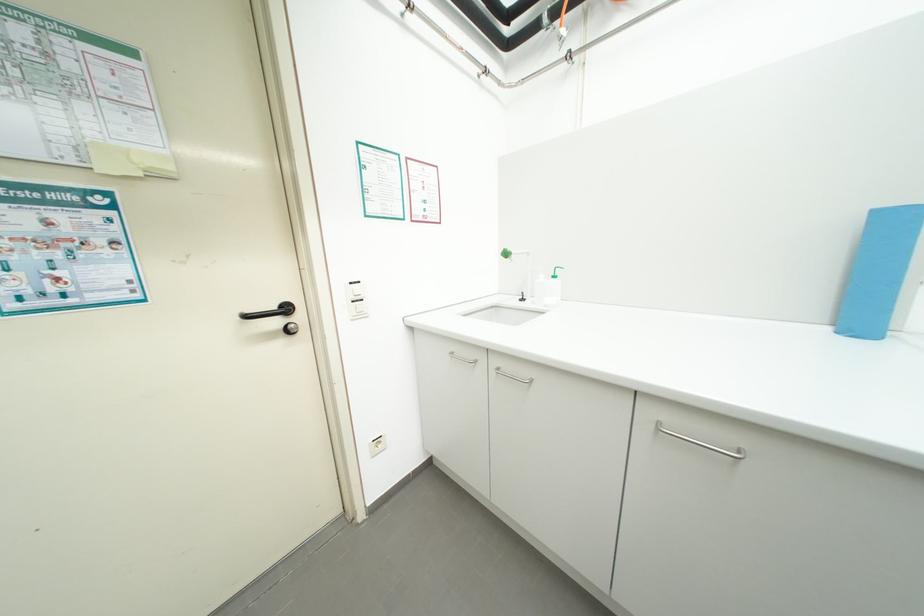
Identify the location of white light switch. (358, 308).